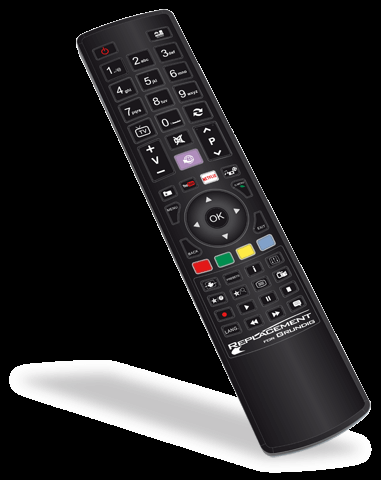
You are a GUI agent. You are given a task and a screenshot of the screen. Output one action in this format:
    pyautogui.click(x=<x>, y=<y>)
    Task: Click on the colored buttons on tv remote control
    
    Given the screenshot: What is the action you would take?
    pyautogui.click(x=203, y=265), pyautogui.click(x=225, y=258), pyautogui.click(x=245, y=250), pyautogui.click(x=267, y=244)